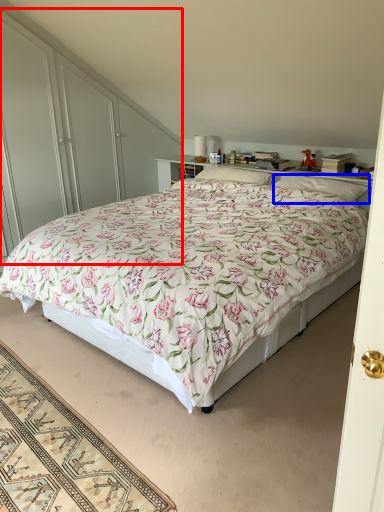
Question: Which of the following is the closest to the observer, dresser (highlighted by a red box) or pillow (highlighted by a blue box)?

Choices:
 (A) dresser
 (B) pillow

Answer: (B)